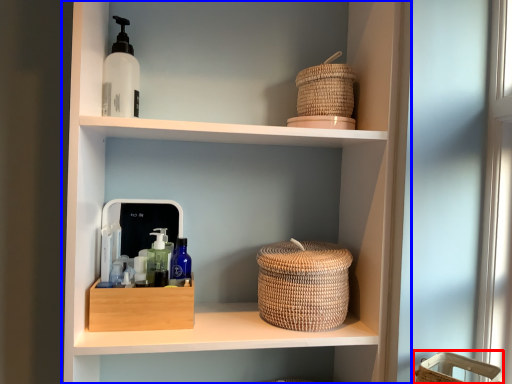
Question: Which of the following is the farthest to the observer, basket (highlighted by a red box) or shelf (highlighted by a blue box)?

Choices:
 (A) basket
 (B) shelf

Answer: (B)